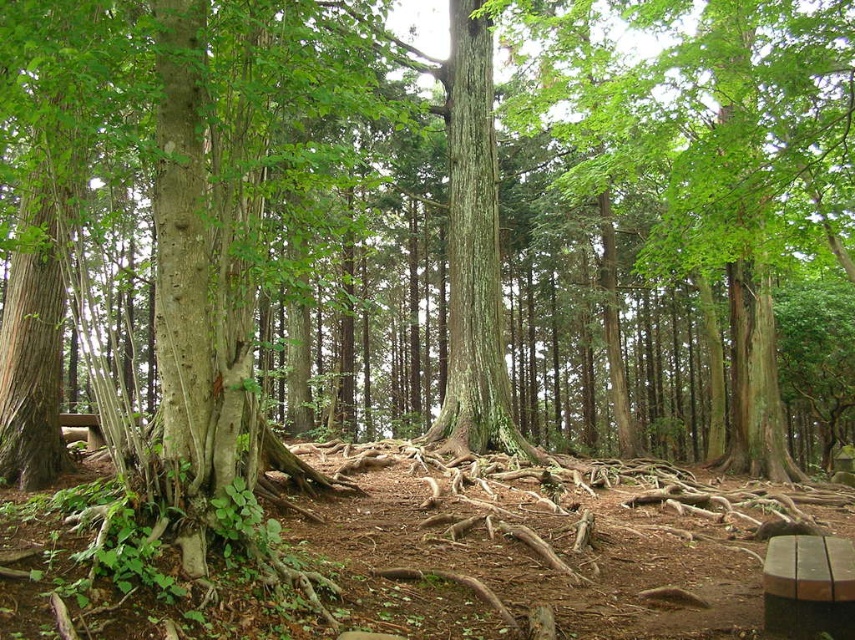
Question: Which of the following is the farthest from the observer?

Choices:
 (A) green rough bark tree at upper center
 (B) green rough bark tree trunk at center

Answer: (B)

Question: Which object appears closest to the camera in this image?

Choices:
 (A) green rough bark tree at upper center
 (B) green rough bark tree trunk at center

Answer: (A)

Question: Can you confirm if green rough bark tree at upper center is thinner than green rough bark tree trunk at center?

Choices:
 (A) yes
 (B) no

Answer: (B)

Question: Is green rough bark tree at upper center in front of green rough bark tree trunk at center?

Choices:
 (A) no
 (B) yes

Answer: (B)

Question: Is green rough bark tree at upper center above green rough bark tree trunk at center?

Choices:
 (A) yes
 (B) no

Answer: (A)